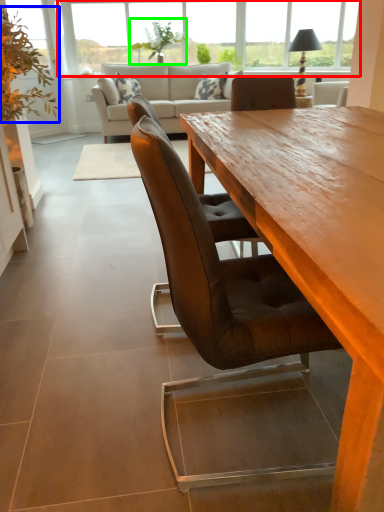
Question: Which object is the farthest from window (highlighted by a red box)? Choose among these: plant (highlighted by a blue box) or plant (highlighted by a green box).

Choices:
 (A) plant
 (B) plant

Answer: (A)